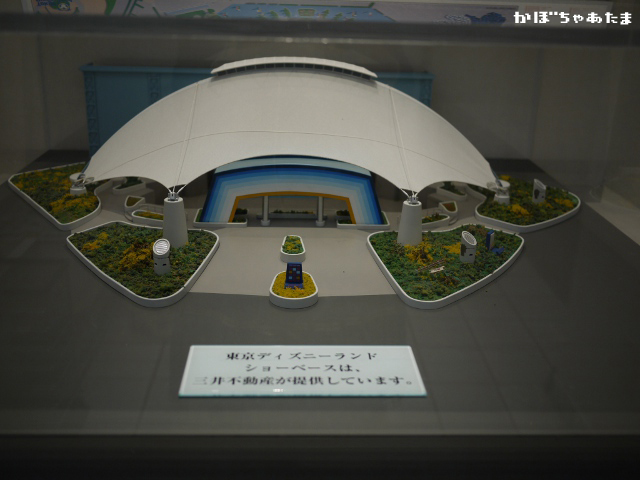
You are a GUI agent. You are given a task and a screenshot of the screen. Output one action in this format:
    pyautogui.click(x=<x>, y=<y>)
    Task: Click on the mat
    The width and height of the screenshot is (640, 480).
    Given the screenshot: What is the action you would take?
    pyautogui.click(x=353, y=357)